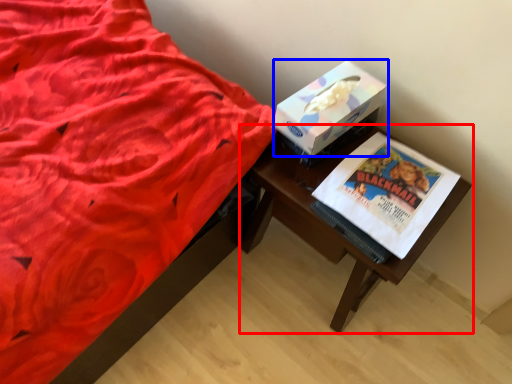
Question: Which object appears farthest to the camera in this image, table (highlighted by a red box) or box (highlighted by a blue box)?

Choices:
 (A) table
 (B) box

Answer: (B)